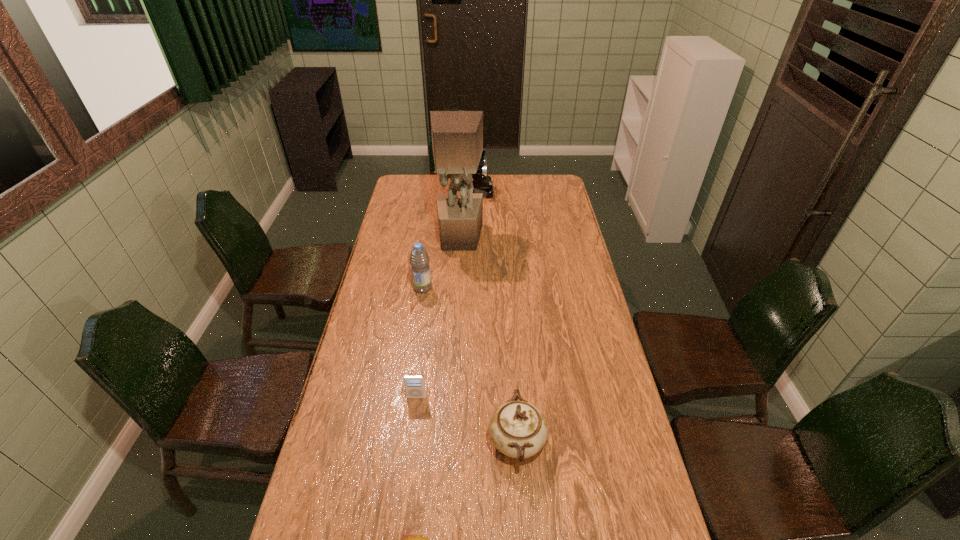
This screenshot has width=960, height=540. I want to click on vacant space that satisfies the following two spatial constraints: 1. on the lens mount of the camcorder; 2. on the front-facing side of the iPod, so click(x=468, y=397).

Identify the location of blank space that satisfies the following two spatial constraints: 1. on the lens mount of the camcorder; 2. on the front-facing side of the fifth nearest object. The image size is (960, 540). (471, 238).

This screenshot has width=960, height=540. Identify the location of free space in the image that satisfies the following two spatial constraints: 1. on the front-facing side of the chinaware; 2. on the right side of the third nearest object. (411, 442).

I want to click on free space in the image that satisfies the following two spatial constraints: 1. on the lens mount of the camcorder; 2. on the front side of the fourth nearest object, so click(469, 288).

Locate an element on the screen. vacant space that satisfies the following two spatial constraints: 1. on the lens mount of the farthest object; 2. on the front side of the water bottle is located at coordinates (469, 288).

Image resolution: width=960 pixels, height=540 pixels. Identify the location of vacant area in the image that satisfies the following two spatial constraints: 1. on the lens mount of the chinaware; 2. on the right side of the farthest object. (466, 442).

Locate an element on the screen. Image resolution: width=960 pixels, height=540 pixels. vacant area in the image that satisfies the following two spatial constraints: 1. on the front-facing side of the third shortest object; 2. on the left side of the tallest object is located at coordinates (447, 442).